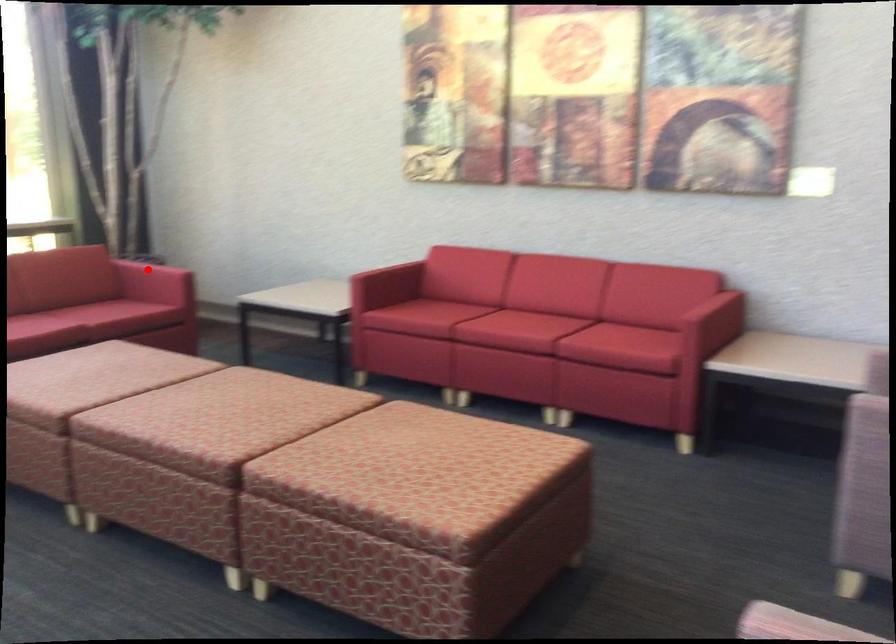
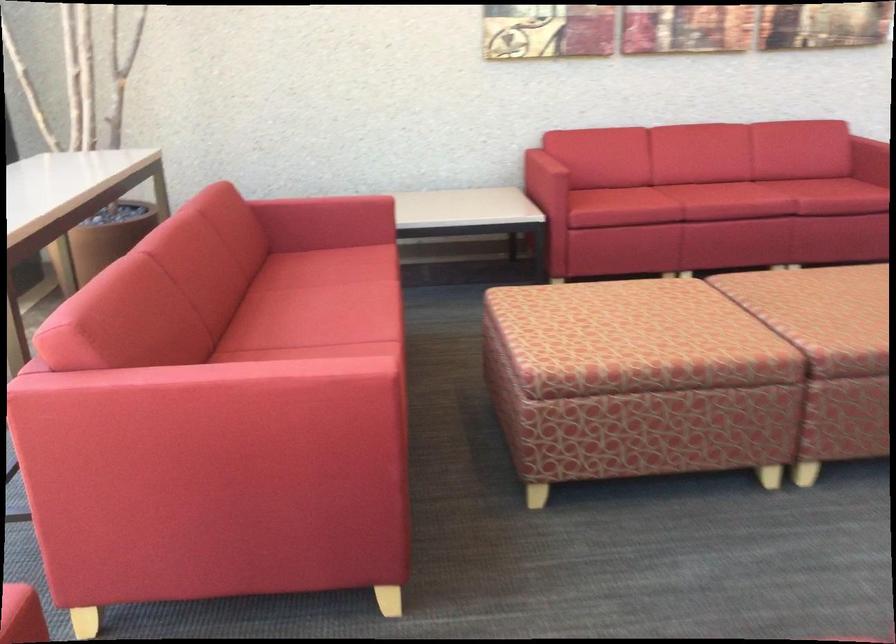
The point at the highlighted location is marked in the first image. Where is the corresponding point in the second image?

(326, 207)